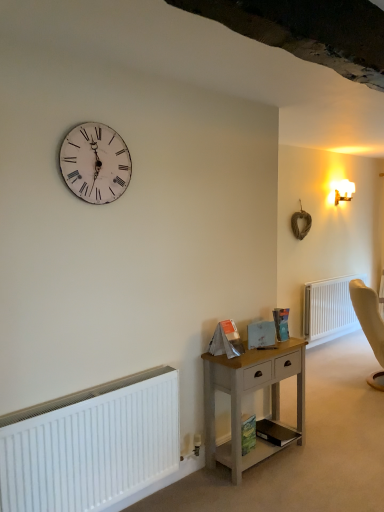
Find the location of a particular element. free spot to the right of light wood nightstand at lower center is located at coordinates (329, 457).